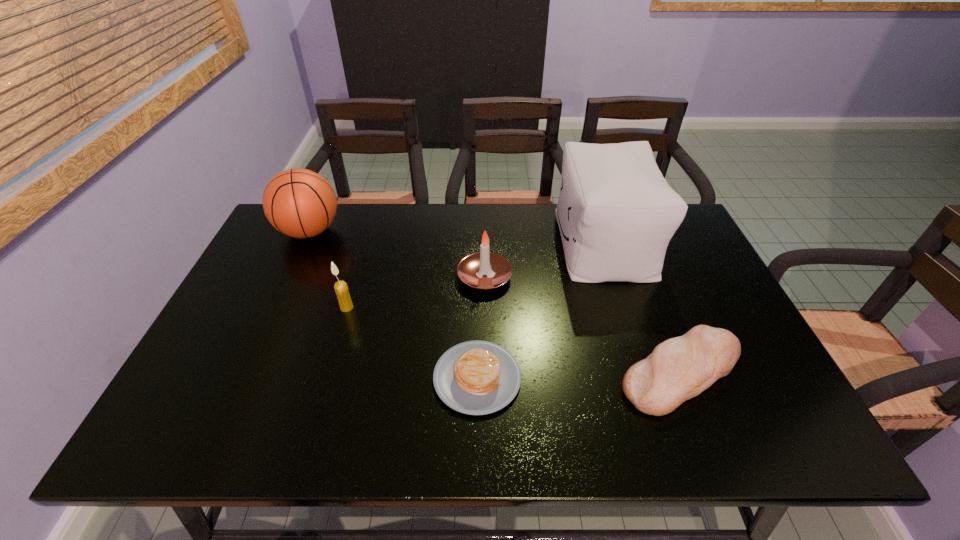
In order to click on cushion in this screenshot , I will do `click(616, 213)`.

Locate an element on the screen. the leftmost object is located at coordinates (300, 203).

Where is `basketball`? This screenshot has width=960, height=540. basketball is located at coordinates (300, 203).

You are a GUI agent. You are given a task and a screenshot of the screen. Output one action in this format:
    pyautogui.click(x=<x>, y=<y>)
    Task: Click on the fourth farthest object
    
    Given the screenshot: What is the action you would take?
    pyautogui.click(x=341, y=288)

Find the location of a particular element. This screenshot has width=960, height=540. the fifth object from right to left is located at coordinates (341, 288).

Where is `the farther candle`? The height and width of the screenshot is (540, 960). the farther candle is located at coordinates (471, 269).

This screenshot has height=540, width=960. What are the coordinates of `the fifth tallest object` in the screenshot? It's located at (678, 369).

Find the location of a particular element. The width and height of the screenshot is (960, 540). pancake is located at coordinates (476, 377).

At what (x,y) coordinates should I click in order to perform the action: click on vacant area situated 0.310m on the side of the tallest object with the smiley face. Please return your answer as a coordinate pair (x, y). Looking at the image, I should click on (458, 242).

You are a GUI agent. You are given a task and a screenshot of the screen. Output one action in this format:
    pyautogui.click(x=<x>, y=<y>)
    Task: Click on the vacant space located on the side of the tallest object with the smiley face
    
    Given the screenshot: What is the action you would take?
    pyautogui.click(x=490, y=242)